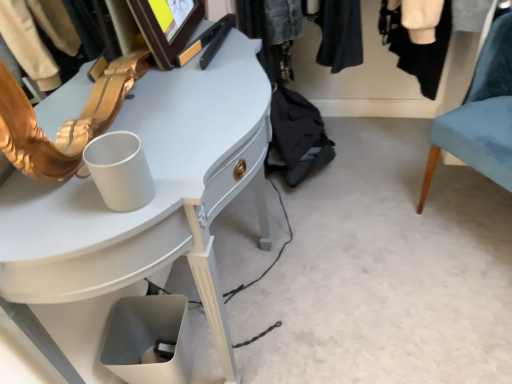
The image size is (512, 384). I want to click on free spot behind velvet teal chair at right, so click(x=404, y=153).